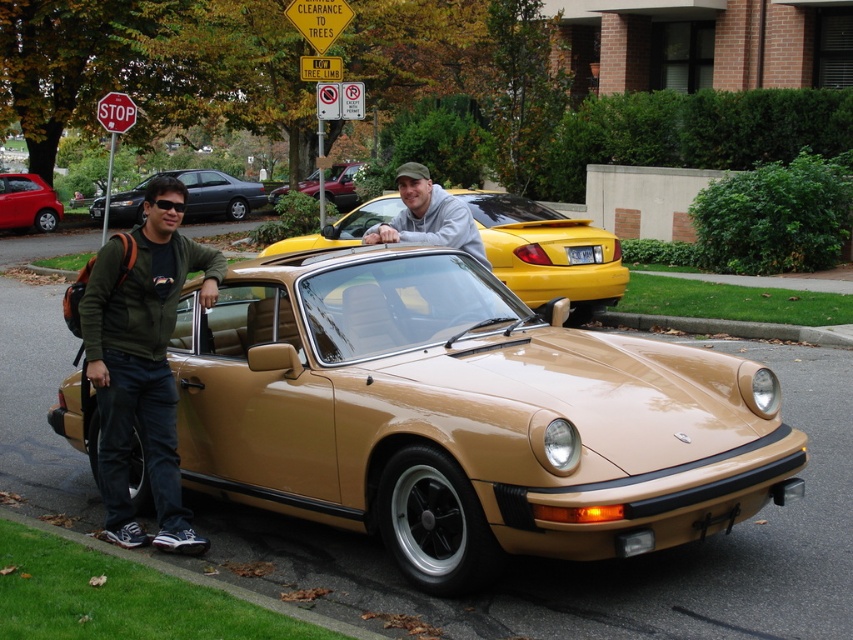
Question: Is green fabric jacket at left positioned in front of yellow plastic license plate at center?

Choices:
 (A) yes
 (B) no

Answer: (A)

Question: Which point appears closest to the camera in this image?

Choices:
 (A) (199, 214)
 (B) (816, 330)
 (C) (167, 518)
 (D) (352, 180)

Answer: (C)

Question: Observing the image, what is the correct spatial positioning of green fabric jacket at left in reference to red plastic stop sign at upper left?

Choices:
 (A) right
 (B) left

Answer: (A)

Question: Does gray cotton hoodie at center have a greater width compared to concrete at lower center?

Choices:
 (A) no
 (B) yes

Answer: (A)

Question: Which point is farther to the camera?

Choices:
 (A) (268, 429)
 (B) (129, 116)
 (C) (318, 195)

Answer: (C)

Question: Considering the real-world distances, which object is farthest from the matte black hatchback at left?

Choices:
 (A) tan metallic car at center
 (B) yellow plastic license plate at center

Answer: (A)